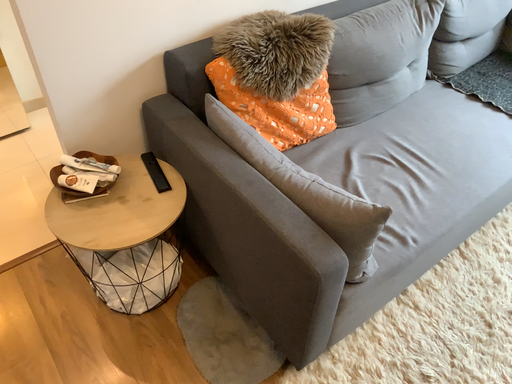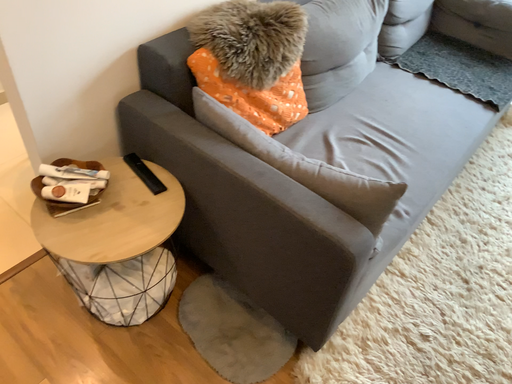
Question: Which way did the camera rotate in the video?

Choices:
 (A) rotated right
 (B) rotated left

Answer: (A)